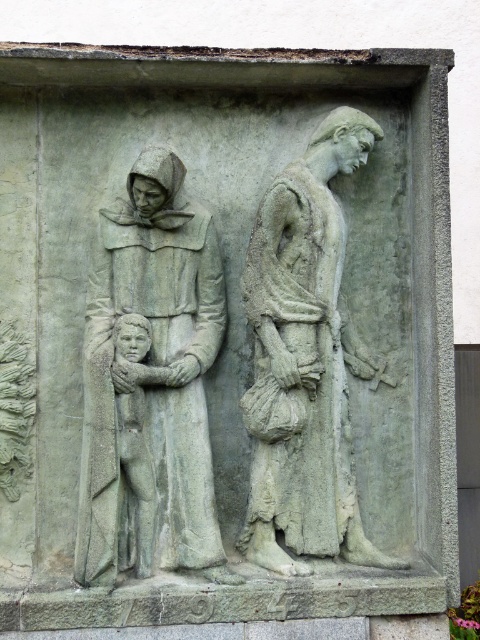
You are standing in front of a stone relief sculpture. You see the gray stone figure at left. If you want to take a photo of it with your camera, which is 17.59 feet away from the figure, will you be able to capture the entire sculpture in one shot?

The gray stone figure at left is 17.59 feet away from the camera. Whether the entire sculpture can be captured depends on the camera lens and field of view, but the distance itself is feasible for photography.

You are an art conservator examining the stone relief sculpture. You notice the gray stone figure at left and the gray stone figure at center. Which figure takes up more space in the relief?

The gray stone figure at center occupies more space than the gray stone figure at left according to the description.

Based on the scene described, which object has a greater width when comparing the gray stone figure at center and the gray stone child at center?

The gray stone figure at center has a greater width than the gray stone child at center.